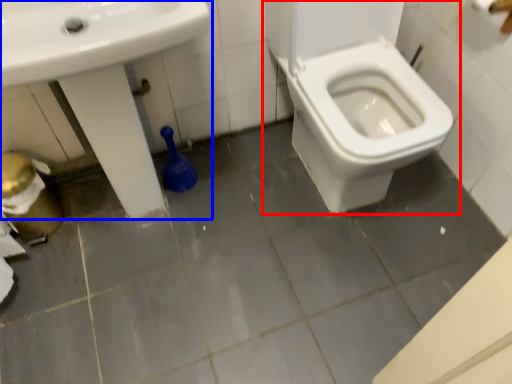
Question: Which point is further to the camera, toilet (highlighted by a red box) or sink (highlighted by a blue box)?

Choices:
 (A) toilet
 (B) sink

Answer: (A)